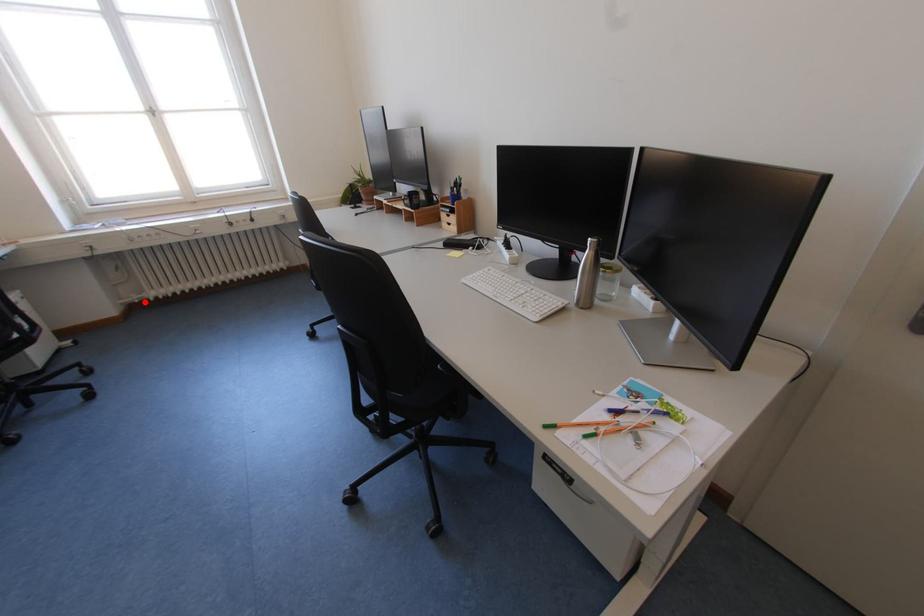
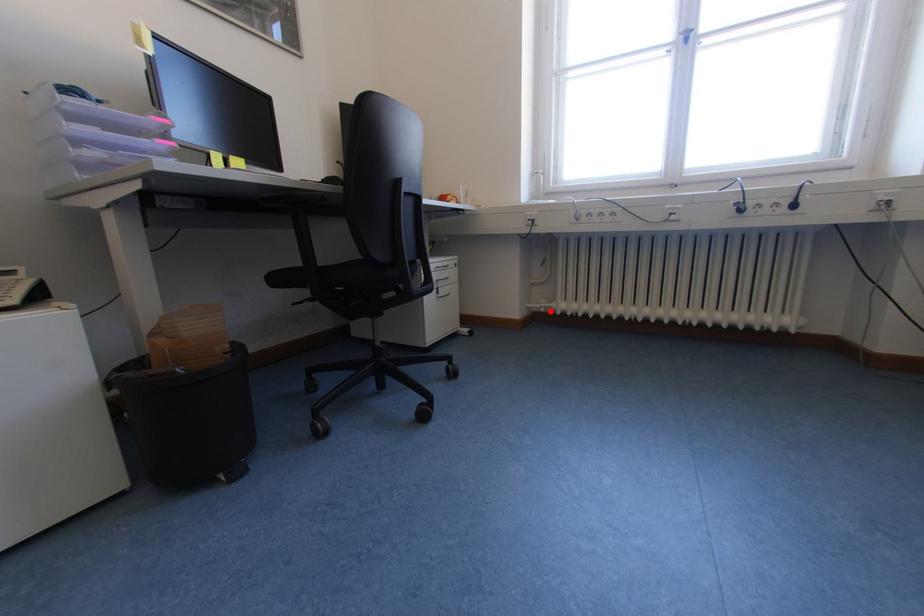
Looking at this image, I am providing you with two images of the same scene from different viewpoints. A red point is marked on the first image and another point is marked on the second image. Are the points marked in image1 and image2 representing the same 3D position?

Yes